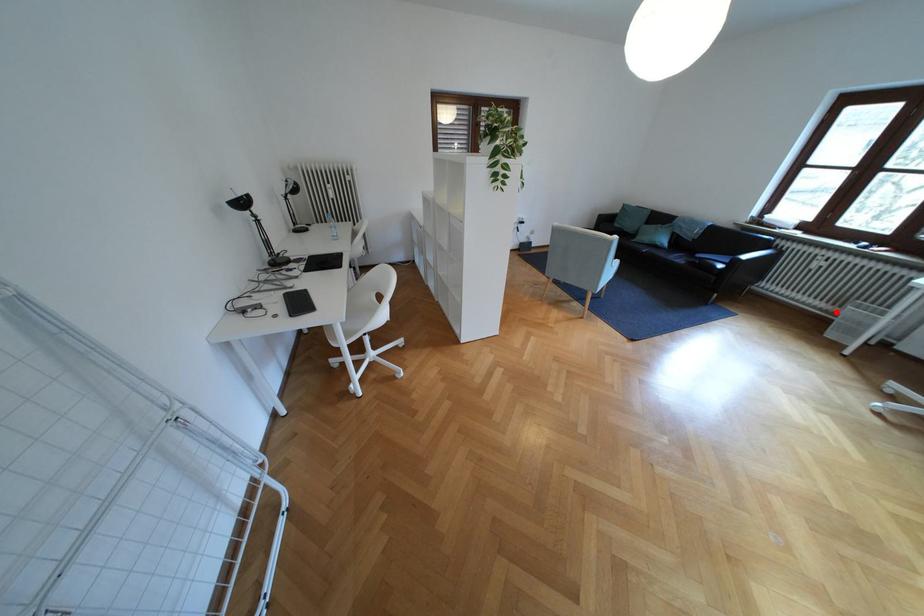
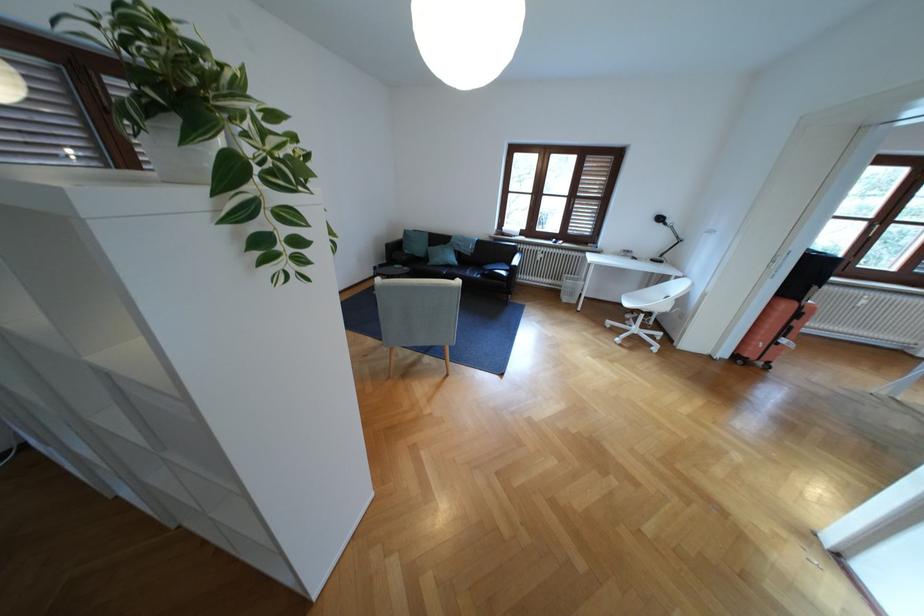
Question: I am providing you with two images of the same scene from different viewpoints. Image1 has a red point marked. In image2, the corresponding 3D location appears at what relative position? Reply with the corresponding letter.

Choices:
 (A) Closer
 (B) Farther

Answer: (A)